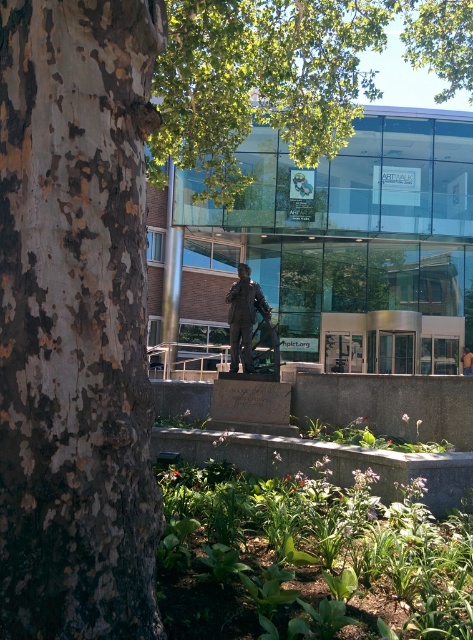
Which is behind, point (239, 326) or point (469, 372)?

Point (469, 372)

Which of these two, bronze statue at center or yellow t-shirt at center, stands shorter?

yellow t-shirt at center

Is point (245, 262) more distant than point (464, 362)?

No, (245, 262) is closer to viewer.

Where is `bronze statue at center`? bronze statue at center is located at coordinates (244, 316).